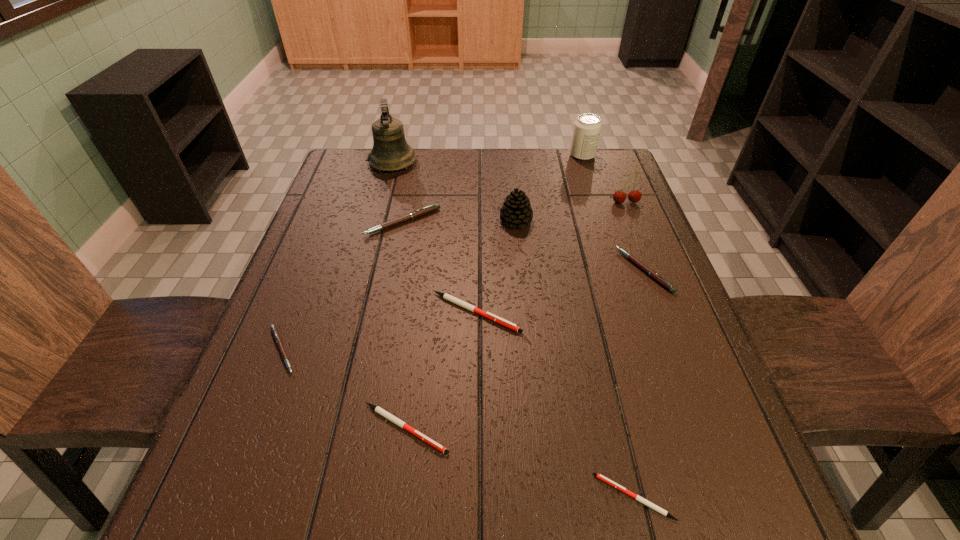
At what (x,y) coordinates should I click in order to perform the action: click on the tallest object. Please return your answer as a coordinate pair (x, y). Looking at the image, I should click on pos(390,152).

The height and width of the screenshot is (540, 960). I want to click on soda can, so click(x=587, y=127).

The width and height of the screenshot is (960, 540). I want to click on cherry, so click(x=634, y=196).

At what (x,y) coordinates should I click in order to perform the action: click on pinecone. Please return your answer as a coordinate pair (x, y). Looking at the image, I should click on (516, 211).

At what (x,y) coordinates should I click in order to perform the action: click on the fifth tallest object. Please return your answer as a coordinate pair (x, y). Looking at the image, I should click on (434, 207).

Where is `the tallest pen`? the tallest pen is located at coordinates (434, 207).

Identify the location of the second farthest pink pen. The width and height of the screenshot is (960, 540). (646, 269).

I want to click on the second biggest pink pen, so click(646, 269).

Where is `the biggest white pen`? the biggest white pen is located at coordinates (488, 315).

In order to click on the leftmost pen in this screenshot , I will do `click(277, 338)`.